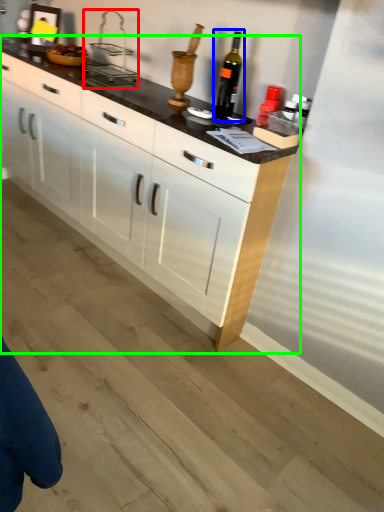
Question: Which object is the farthest from appliance (highlighted by a red box)? Choose among these: wine bottle (highlighted by a blue box) or cabinetry (highlighted by a green box).

Choices:
 (A) wine bottle
 (B) cabinetry

Answer: (A)